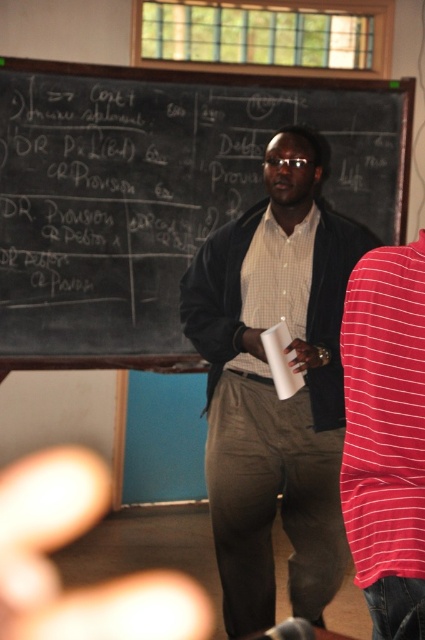
Is blackboard at upper center bigger than white matte paper cup at center?

Yes, blackboard at upper center is bigger than white matte paper cup at center.

Is blackboard at upper center above white matte paper cup at center?

Correct, blackboard at upper center is located above white matte paper cup at center.

Between point (5, 180) and point (289, 396), which one is positioned behind?

The point (5, 180) is behind.

Where is `blackboard at upper center`? blackboard at upper center is located at coordinates (158, 193).

This screenshot has height=640, width=425. I want to click on blackboard at upper center, so point(158,193).

Does blackboard at upper center appear on the left side of checkered fabric shirt at center?

Indeed, blackboard at upper center is positioned on the left side of checkered fabric shirt at center.

Between point (2, 340) and point (288, 246), which one is positioned behind?

Point (2, 340)

Identify the location of blackboard at upper center. (158, 193).

Who is more forward, (286, 284) or (252, 323)?

Positioned in front is point (286, 284).

Does point (266, 458) come behind point (266, 307)?

That is False.

This screenshot has width=425, height=640. Find the location of `matte black jacket at center`. matte black jacket at center is located at coordinates (272, 385).